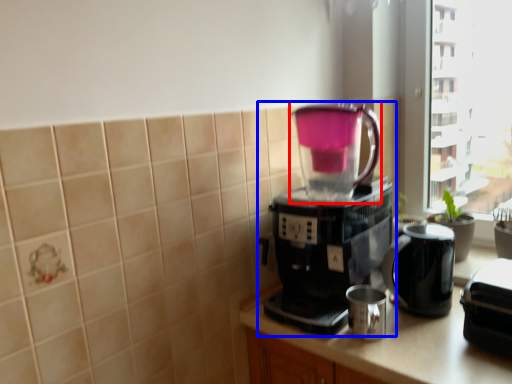
Question: Which object is further to the camera taking this photo, coffeepot (highlighted by a red box) or coffee maker (highlighted by a blue box)?

Choices:
 (A) coffeepot
 (B) coffee maker

Answer: (A)